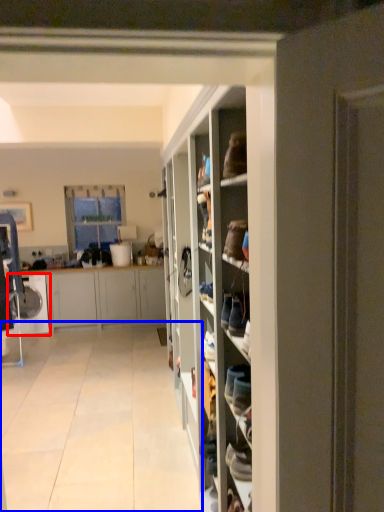
Question: Which of the following is the closest to the observer, washing machine (highlighted by a red box) or corridor (highlighted by a blue box)?

Choices:
 (A) washing machine
 (B) corridor

Answer: (B)